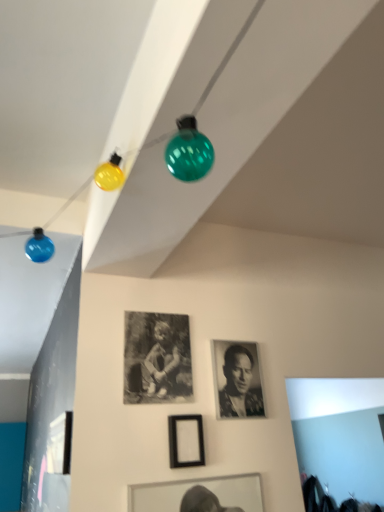
Question: Should I look upward or downward to see black matte picture frame at center, positioned as the 1th picture frame in right-to-left order?

Choices:
 (A) down
 (B) up

Answer: (A)

Question: Is the position of black matte photo frame at center, which is counted as the 2th picture frame, starting from the right, less distant than that of black matte picture frame at center, positioned as the 1th picture frame in right-to-left order?

Choices:
 (A) no
 (B) yes

Answer: (A)

Question: Can you confirm if black matte photo frame at center, which is counted as the second picture frame, starting from the left, is shorter than black matte picture frame at center, positioned as the 1th picture frame in right-to-left order?

Choices:
 (A) yes
 (B) no

Answer: (B)

Question: Are black matte photo frame at center, which is counted as the second picture frame, starting from the left, and black matte picture frame at center, positioned as the 1th picture frame in right-to-left order, located far from each other?

Choices:
 (A) yes
 (B) no

Answer: (B)

Question: Is black matte photo frame at center, which is counted as the second picture frame, starting from the left, outside of black matte picture frame at center, positioned as the 1th picture frame in right-to-left order?

Choices:
 (A) no
 (B) yes

Answer: (B)

Question: From a real-world perspective, is black matte photo frame at center, which is counted as the 2th picture frame, starting from the right, physically below black matte picture frame at center, positioned as the 1th picture frame in right-to-left order?

Choices:
 (A) yes
 (B) no

Answer: (B)

Question: Does black matte photo frame at center, which is counted as the second picture frame, starting from the left, appear on the left side of black matte picture frame at center, positioned as the 1th picture frame in right-to-left order?

Choices:
 (A) no
 (B) yes

Answer: (B)

Question: Does black and white photograph at center appear on the right side of black matte picture frame at center, arranged as the 3th picture frame when viewed from the left?

Choices:
 (A) no
 (B) yes

Answer: (B)

Question: Is black matte picture frame at center, arranged as the 3th picture frame when viewed from the left, located within black and white photograph at center?

Choices:
 (A) yes
 (B) no

Answer: (B)

Question: From a real-world perspective, is black and white photograph at center over black matte picture frame at center, arranged as the 3th picture frame when viewed from the left?

Choices:
 (A) no
 (B) yes

Answer: (B)

Question: Is black and white photograph at center facing towards black matte picture frame at center, positioned as the 1th picture frame in right-to-left order?

Choices:
 (A) yes
 (B) no

Answer: (B)

Question: Is black and white photograph at center further to the viewer compared to black matte picture frame at center, arranged as the 3th picture frame when viewed from the left?

Choices:
 (A) yes
 (B) no

Answer: (A)

Question: Is black and white photograph at center facing away from black matte picture frame at center, arranged as the 3th picture frame when viewed from the left?

Choices:
 (A) no
 (B) yes

Answer: (A)

Question: Is black matte picture frame at center, arranged as the 3th picture frame when viewed from the left, aimed at black matte photo frame at center, which is counted as the 2th picture frame, starting from the right?

Choices:
 (A) no
 (B) yes

Answer: (A)